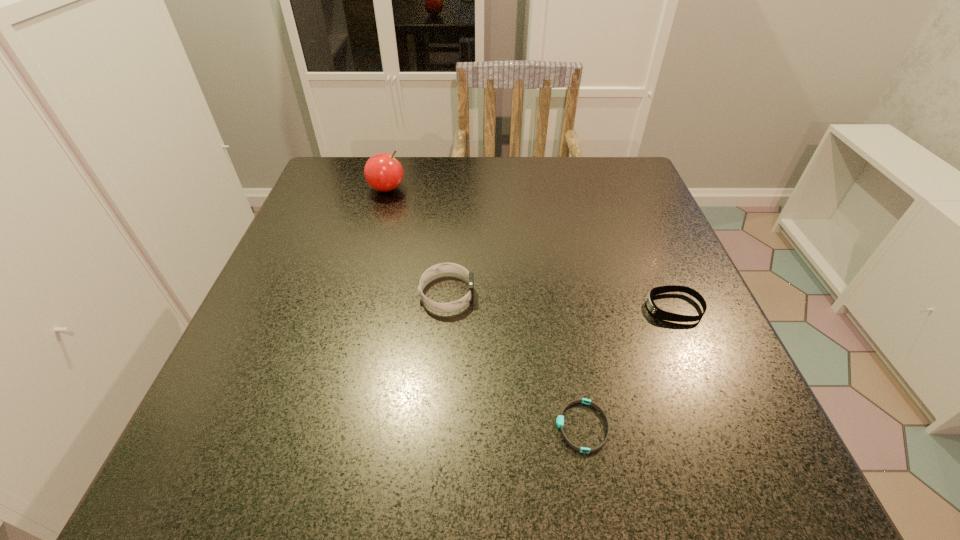
Where is `object situated at the far left corner`? This screenshot has height=540, width=960. object situated at the far left corner is located at coordinates (384, 173).

Identify the location of vacant space at the far edge of the desktop. The height and width of the screenshot is (540, 960). (566, 208).

Identify the location of vacant space at the near edge of the desktop. Image resolution: width=960 pixels, height=540 pixels. (554, 448).

In the image, there is a desktop. Identify the location of vacant space at the left edge. The width and height of the screenshot is (960, 540). (341, 302).

The height and width of the screenshot is (540, 960). What are the coordinates of `free spot at the right edge of the desktop` in the screenshot? It's located at (669, 340).

At what (x,y) coordinates should I click in order to perform the action: click on free space at the far left corner. Please return your answer as a coordinate pair (x, y). Image resolution: width=960 pixels, height=540 pixels. Looking at the image, I should click on (329, 180).

The height and width of the screenshot is (540, 960). In order to click on vacant space at the far right corner of the desktop in this screenshot , I will do `click(592, 185)`.

Locate an element on the screen. Image resolution: width=960 pixels, height=540 pixels. free spot between the rightmost object and the apple is located at coordinates (530, 248).

Identify the location of free space between the second wristband from left to right and the third tallest object. The width and height of the screenshot is (960, 540). (628, 367).

Where is `vacant area that lies between the rightmost object and the farthest object`? vacant area that lies between the rightmost object and the farthest object is located at coordinates (530, 248).